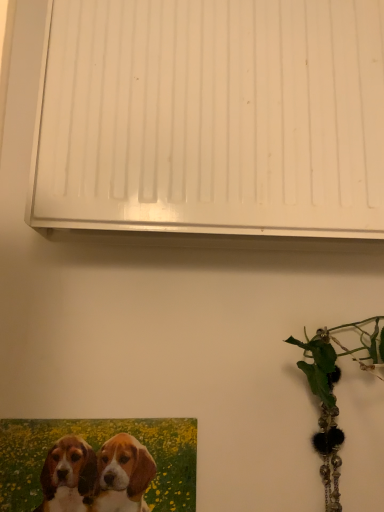
Question: Should I look upward or downward to see green matte painting at lower left?

Choices:
 (A) up
 (B) down

Answer: (B)